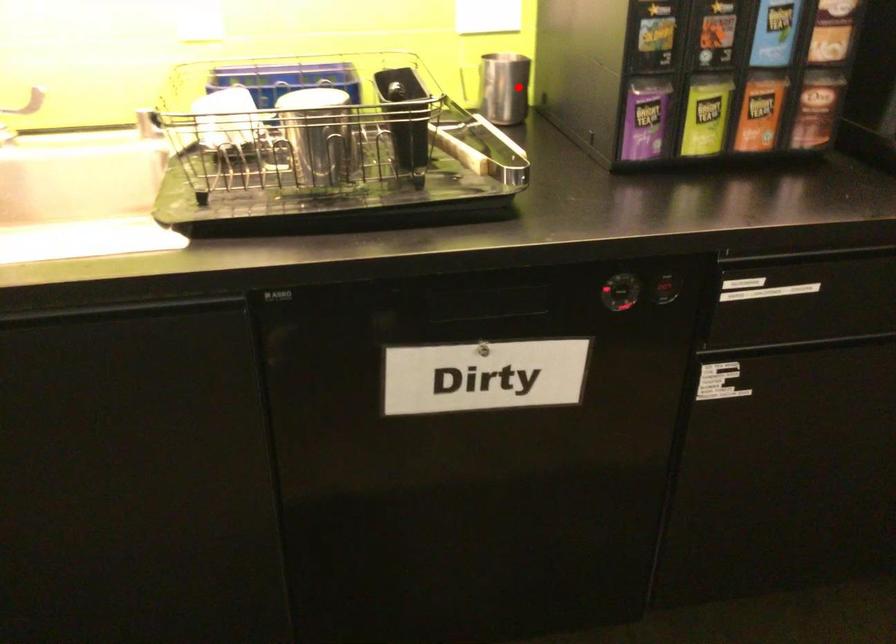
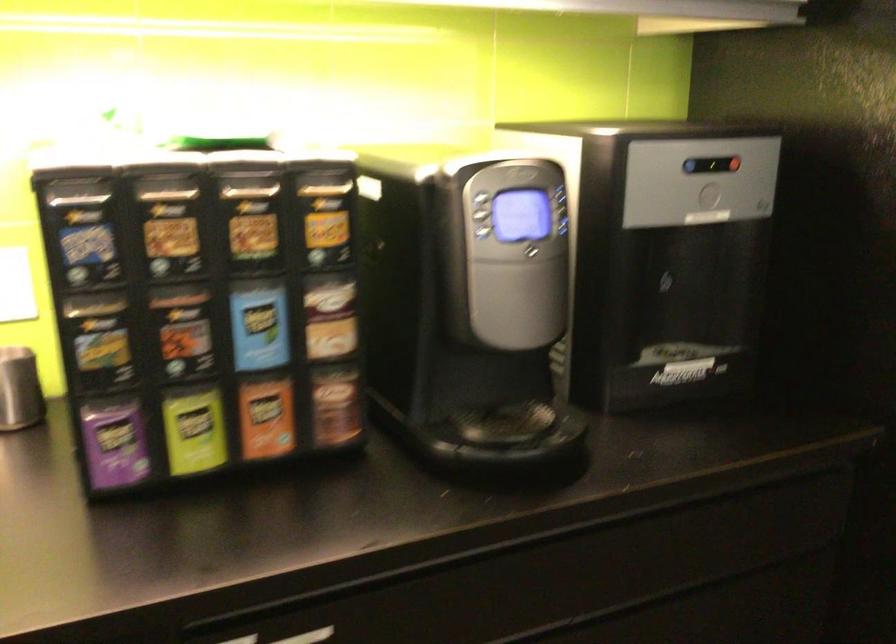
In the second image, find the point that corresponds to the highlighted location in the first image.

(19, 389)